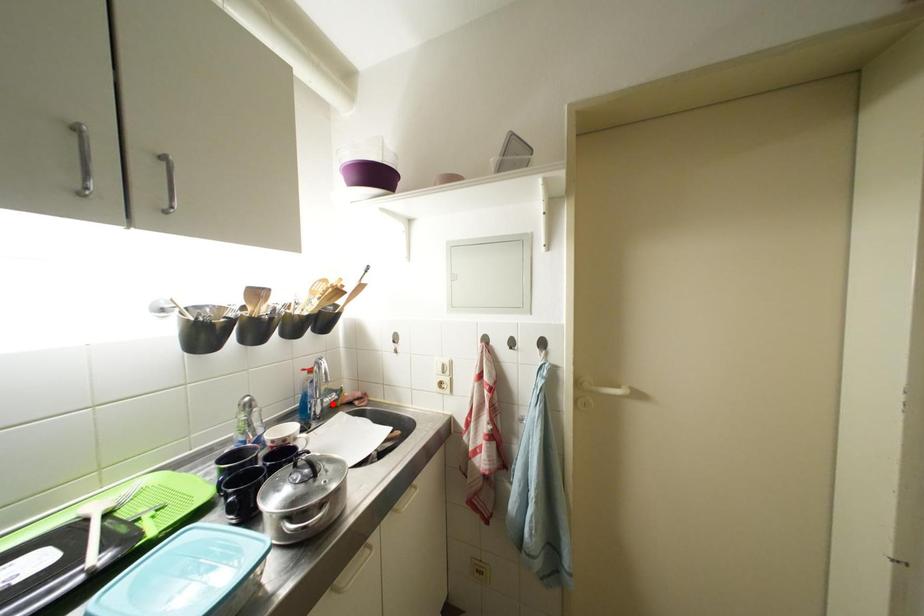
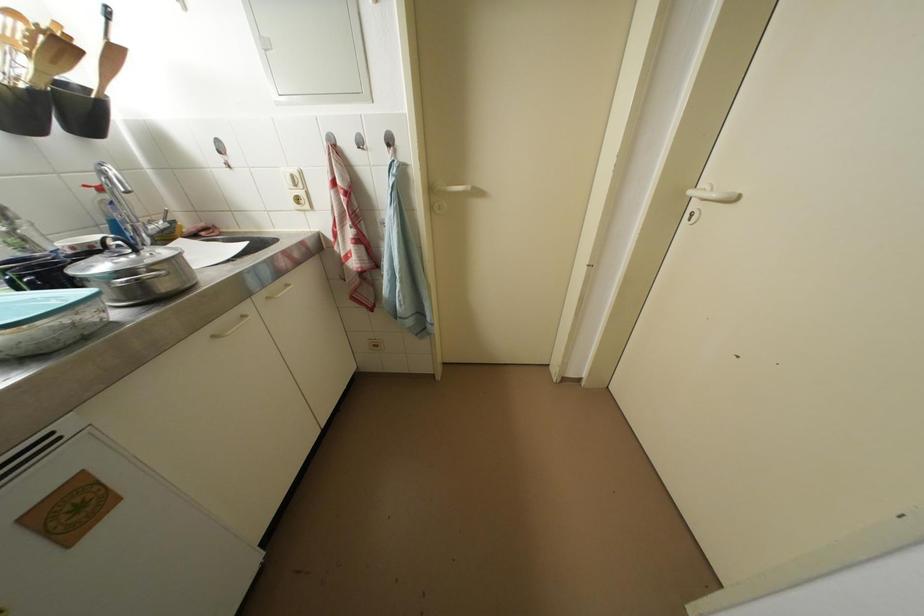
Where in the second image is the point corresponding to the highlighted location from the first image?

(157, 231)